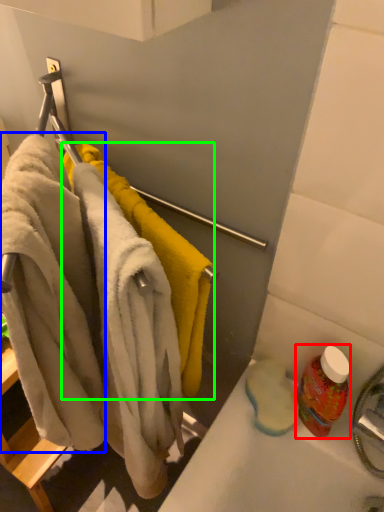
Question: Which object is positioned closest to cleaning product (highlighted by a red box)? Select from bath towel (highlighted by a blue box) and towel (highlighted by a green box).

Choices:
 (A) bath towel
 (B) towel

Answer: (B)